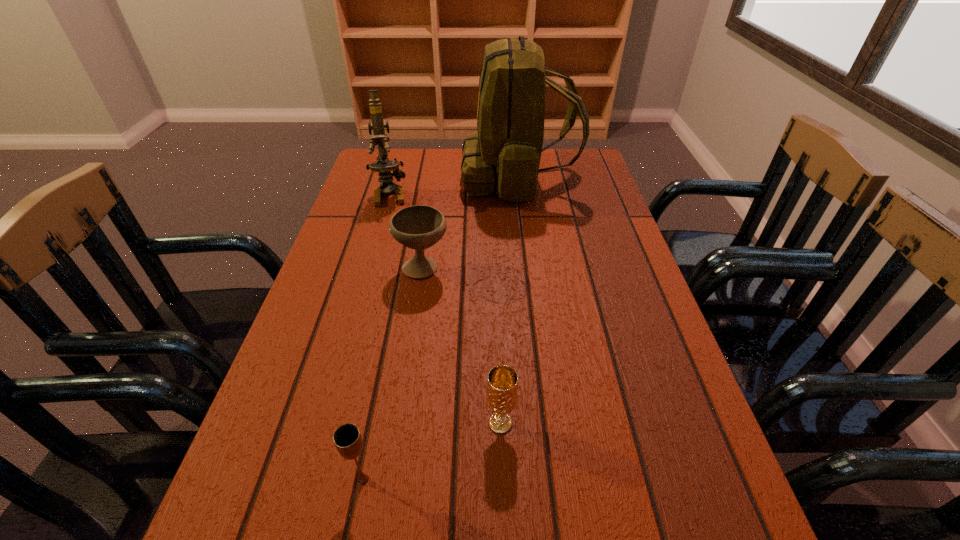
You are a GUI agent. You are given a task and a screenshot of the screen. Output one action in this format:
    pyautogui.click(x=<x>, y=<y>)
    Task: Click on the free space at the left edge of the desktop
    The width and height of the screenshot is (960, 540).
    Given the screenshot: What is the action you would take?
    pyautogui.click(x=407, y=192)

In the image, there is a desktop. Where is `free space at the right edge`? This screenshot has height=540, width=960. free space at the right edge is located at coordinates (587, 273).

Identify the location of free space at the far right corner of the desktop. The width and height of the screenshot is (960, 540). (563, 150).

Image resolution: width=960 pixels, height=540 pixels. What are the coordinates of `vacant space that is in between the tallest object and the farthest chalice` in the screenshot? It's located at (470, 222).

I want to click on free space that is in between the leftmost object and the backpack, so click(454, 186).

You are a GUI agent. You are given a task and a screenshot of the screen. Output one action in this format:
    pyautogui.click(x=<x>, y=<y>)
    Task: Click on the vacant area between the nearest object and the leftmost object
    This screenshot has height=540, width=960.
    Given the screenshot: What is the action you would take?
    pyautogui.click(x=376, y=336)

This screenshot has width=960, height=540. In order to click on empty space between the fourth farthest object and the third farthest object in this screenshot , I will do `click(462, 345)`.

Locate an element on the screen. vacant area that lies between the nearest chalice and the second farthest chalice is located at coordinates (432, 451).

Image resolution: width=960 pixels, height=540 pixels. I want to click on free spot between the backpack and the second nearest object, so click(x=510, y=300).

Locate an element on the screen. free point between the backpack and the second tallest object is located at coordinates (454, 186).